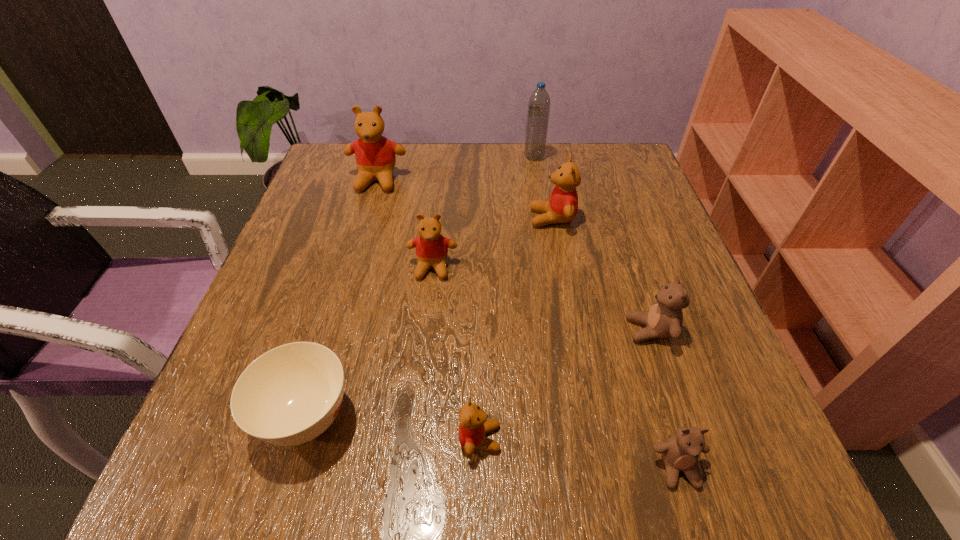
This screenshot has height=540, width=960. In order to click on object located in the far left corner section of the desktop in this screenshot , I will do `click(375, 155)`.

Locate an element on the screen. The width and height of the screenshot is (960, 540). object that is at the near left corner is located at coordinates (291, 394).

Where is `object located in the near right corner section of the desktop`? object located in the near right corner section of the desktop is located at coordinates (681, 452).

The width and height of the screenshot is (960, 540). I want to click on free space at the far edge, so click(430, 188).

The height and width of the screenshot is (540, 960). In order to click on free space at the near edge of the desktop in this screenshot , I will do `click(444, 468)`.

The height and width of the screenshot is (540, 960). In the image, there is a desktop. Identify the location of free space at the left edge. (316, 245).

In the image, there is a desktop. In order to click on free region at the right edge in this screenshot , I will do `click(589, 201)`.

In the image, there is a desktop. At what (x,y) coordinates should I click in order to perform the action: click on vacant space at the far left corner. Please return your answer as a coordinate pair (x, y). Looking at the image, I should click on point(346,193).

Where is `vacant space at the near left corner of the desktop`? vacant space at the near left corner of the desktop is located at coordinates (256, 489).

The height and width of the screenshot is (540, 960). Find the location of `vacant space at the far right corner of the desktop`. vacant space at the far right corner of the desktop is located at coordinates pyautogui.click(x=620, y=161).